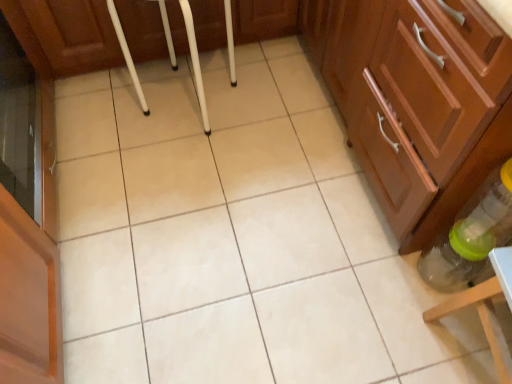
Find the location of a particular element. vacant space underneath white plastic bar stool at center (from a real-world perspective) is located at coordinates (190, 100).